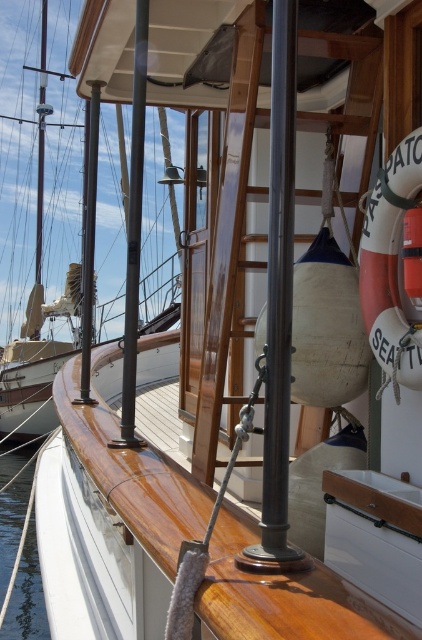
Consider the image. You are standing on the deck of the wooden boat and want to locate the polished dark wood pole at center. According to the coordinates provided, where would you find it?

The polished dark wood pole at center is located at point coordinates of (134, 232).

You are standing on the deck of the wooden boat and want to place a small potted plant between the polished dark wood pole at center and the transparent water at lower left. Based on their positions, where should you position the plant to ensure it is between them?

The polished dark wood pole at center is to the right of transparent water at lower left, so you should place the small potted plant between them by positioning it to the right of the transparent water at lower left and to the left of the polished dark wood pole at center.

You are standing on the boat deck and want to compare the width of the polished dark wood pole at center with the transparent water at lower left. Which one is wider?

The transparent water at lower left is wider than the polished dark wood pole at center.